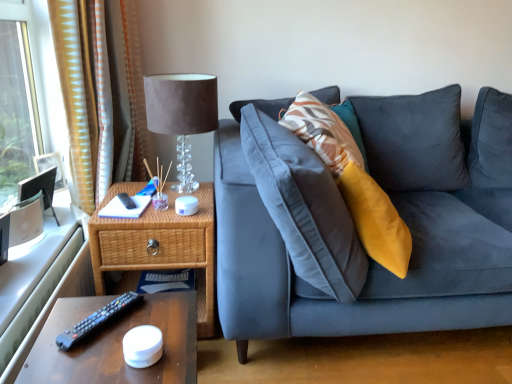
Find the location of a particular element. This screenshot has width=512, height=384. free spot above woven wood nightstand at left (from a real-world perspective) is located at coordinates (136, 199).